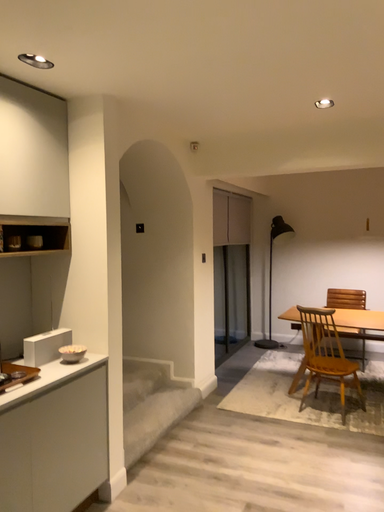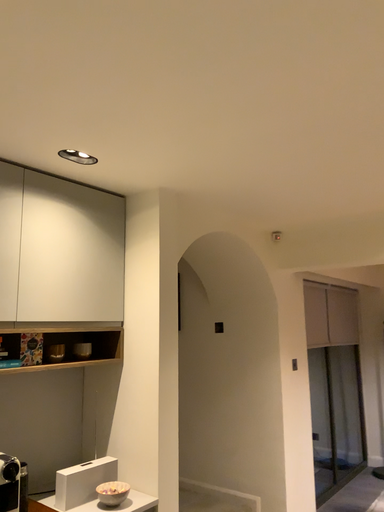
Question: How did the camera likely rotate when shooting the video?

Choices:
 (A) rotated right
 (B) rotated left

Answer: (B)